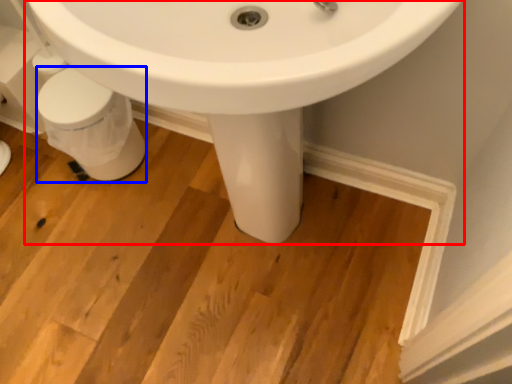
Question: Among these objects, which one is farthest to the camera, sink (highlighted by a red box) or porcelain (highlighted by a blue box)?

Choices:
 (A) sink
 (B) porcelain

Answer: (B)